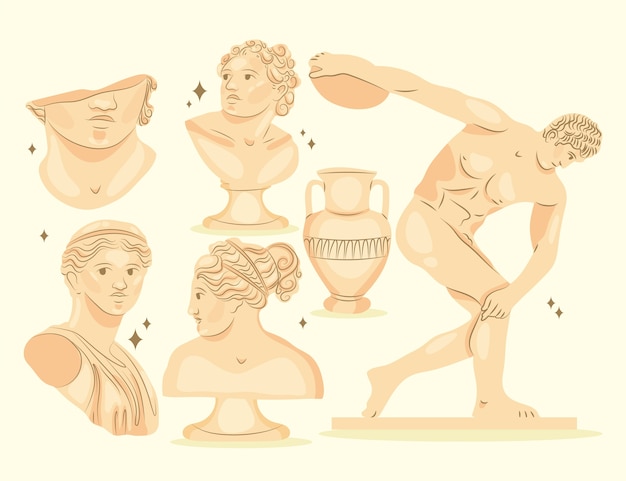
At what (x,y) coordinates should I click in order to perform the action: click on pot. Please return your answer as a coordinate pair (x, y). The width and height of the screenshot is (626, 481). Looking at the image, I should click on (346, 241).